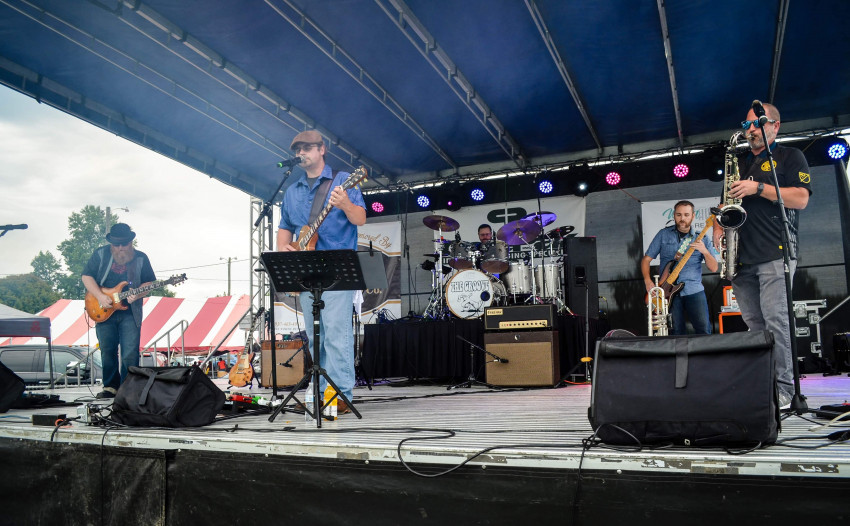
You are a GUI agent. You are given a task and a screenshot of the screen. Output one action in this format:
    pyautogui.click(x=<x>, y=<y>)
    Task: Click on the monitors
    Image resolution: width=850 pixels, height=526 pixels.
    Given the screenshot: What is the action you would take?
    pyautogui.click(x=585, y=255), pyautogui.click(x=676, y=394), pyautogui.click(x=191, y=398), pyautogui.click(x=7, y=390)